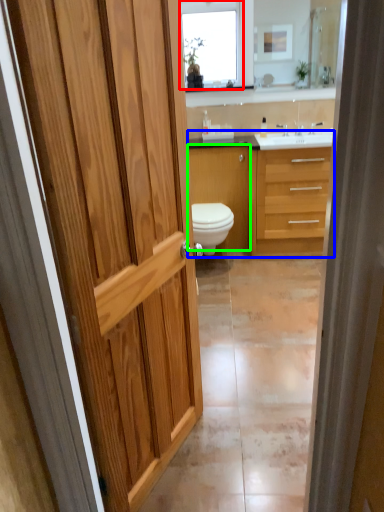
Question: Which is farther away from window (highlighted by a red box)? bathroom cabinet (highlighted by a blue box) or cabinetry (highlighted by a green box)?

Choices:
 (A) bathroom cabinet
 (B) cabinetry

Answer: (A)